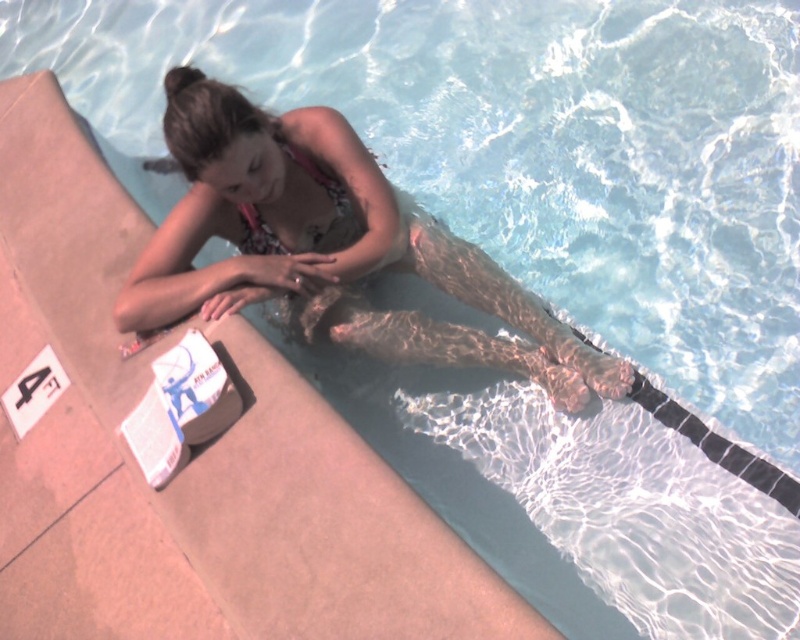
You are a lifeguard observing the scene and need to ensure safety. The floral bikini at center and the patterned fabric bikini top at upper center are both visible. Which one is higher up in the image?

The floral bikini at center has a greater height compared to the patterned fabric bikini top at upper center, so the floral bikini at center is higher up in the image.

You are designing a swimsuit catalog layout and need to place the floral bikini at center and the patterned fabric bikini top at upper center side by side. Which swimsuit has a wider width to consider for the layout?

The floral bikini at center has a larger width than the patterned fabric bikini top at upper center, so it requires more space in the layout.